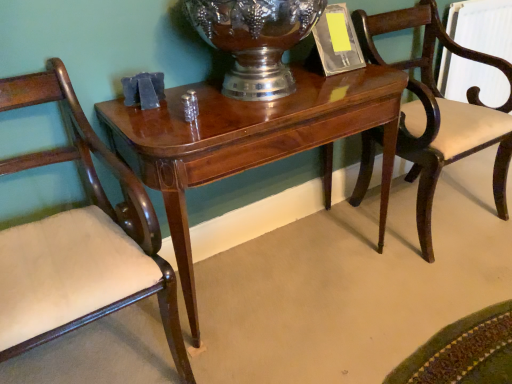
You are a GUI agent. You are given a task and a screenshot of the screen. Output one action in this format:
    pyautogui.click(x=<x>, y=<y>)
    Task: Click on the mahogany wood chair at left, arranged as the 2th chair when viewed from the right
    The image size is (512, 384).
    Given the screenshot: What is the action you would take?
    pyautogui.click(x=79, y=241)

How much space does mahogany wood chair at left, arranged as the first chair when viewed from the left, occupy vertically?

It is 34.05 inches.

I want to click on shiny wood table at center, so click(251, 141).

From a real-world perspective, is mahogany wood chair at left, arranged as the first chair when viewed from the left, positioned above or below shiny wood table at center?

In terms of real-world spatial position, mahogany wood chair at left, arranged as the first chair when viewed from the left, is above shiny wood table at center.

Is mahogany wood chair at left, arranged as the 2th chair when viewed from the right, far away from shiny wood table at center?

No.

Is mahogany wood chair at left, arranged as the 2th chair when viewed from the right, bigger than shiny wood table at center?

No.

Considering their positions, is shiny wood table at center located in front of or behind mahogany wood chair at left, arranged as the first chair when viewed from the left?

shiny wood table at center is positioned farther from the viewer than mahogany wood chair at left, arranged as the first chair when viewed from the left.

From a real-world perspective, starting from the shiny wood table at center, which chair is the 1st one vertically above it? Please provide its 2D coordinates.

[(79, 241)]

Is the surface of shiny wood table at center in direct contact with mahogany wood chair at left, arranged as the 2th chair when viewed from the right?

shiny wood table at center and mahogany wood chair at left, arranged as the 2th chair when viewed from the right, are not in contact.

From a real-world perspective, who is located lower, shiny wood table at center or mahogany wood chair at left, arranged as the 2th chair when viewed from the right?

In real-world perspective, shiny wood table at center is lower.

Is shiny silver vase at center facing towards mahogany wood chair at right, placed as the 2th chair when sorted from left to right?

No.

How different are the orientations of shiny silver vase at center and mahogany wood chair at right, the first chair when ordered from right to left, in degrees?

0.000304 degrees.

Which of these two, shiny silver vase at center or mahogany wood chair at right, the first chair when ordered from right to left, is wider?

Wider between the two is mahogany wood chair at right, the first chair when ordered from right to left.

The height and width of the screenshot is (384, 512). Identify the location of glass vase that is above the mahogany wood chair at right, placed as the 2th chair when sorted from left to right (from a real-world perspective). (255, 40).

From a real-world perspective, is mahogany wood chair at left, arranged as the 2th chair when viewed from the right, on mahogany wood chair at right, the first chair when ordered from right to left?

No.

How distant is mahogany wood chair at left, arranged as the 2th chair when viewed from the right, from mahogany wood chair at right, the first chair when ordered from right to left?

mahogany wood chair at left, arranged as the 2th chair when viewed from the right, and mahogany wood chair at right, the first chair when ordered from right to left, are 1.14 meters apart.

Which object is closer to the camera, mahogany wood chair at left, arranged as the first chair when viewed from the left, or mahogany wood chair at right, the first chair when ordered from right to left?

Positioned in front is mahogany wood chair at left, arranged as the first chair when viewed from the left.

Looking at the image, does mahogany wood chair at left, arranged as the 2th chair when viewed from the right, seem bigger or smaller compared to mahogany wood chair at right, the first chair when ordered from right to left?

In the image, mahogany wood chair at left, arranged as the 2th chair when viewed from the right, appears to be smaller than mahogany wood chair at right, the first chair when ordered from right to left.

Who is shorter, shiny silver vase at center or shiny wood table at center?

With less height is shiny silver vase at center.

Between shiny silver vase at center and shiny wood table at center, which one has smaller width?

With smaller width is shiny silver vase at center.

Based on their positions, is shiny silver vase at center located to the left or right of shiny wood table at center?

Based on their positions, shiny silver vase at center is located to the left of shiny wood table at center.

Could shiny wood table at center be considered to be inside shiny silver vase at center?

Actually, shiny wood table at center is outside shiny silver vase at center.

Is shiny wood table at center located outside shiny silver vase at center?

That's correct, shiny wood table at center is outside of shiny silver vase at center.

From the image's perspective, which one is positioned higher, shiny wood table at center or shiny silver vase at center?

shiny silver vase at center is shown above in the image.

From the picture: Is there a large distance between shiny wood table at center and shiny silver vase at center?

shiny wood table at center is near shiny silver vase at center, not far away.

Which is more to the left, shiny wood table at center or shiny silver vase at center?

Positioned to the left is shiny silver vase at center.

In the scene shown: Is shiny wood table at center closer to camera compared to mahogany wood chair at right, placed as the 2th chair when sorted from left to right?

Yes, shiny wood table at center is in front of mahogany wood chair at right, placed as the 2th chair when sorted from left to right.

Is shiny wood table at center not close to mahogany wood chair at right, the first chair when ordered from right to left?

No, shiny wood table at center is in close proximity to mahogany wood chair at right, the first chair when ordered from right to left.

Considering the positions of objects shiny wood table at center and mahogany wood chair at right, placed as the 2th chair when sorted from left to right, in the image provided, who is more to the right, shiny wood table at center or mahogany wood chair at right, placed as the 2th chair when sorted from left to right,?

mahogany wood chair at right, placed as the 2th chair when sorted from left to right, is more to the right.

You are a GUI agent. You are given a task and a screenshot of the screen. Output one action in this format:
    pyautogui.click(x=<x>, y=<y>)
    Task: Click on the table below the mahogany wood chair at left, arranged as the first chair when viewed from the left (from a real-world perspective)
    The image size is (512, 384).
    Given the screenshot: What is the action you would take?
    pyautogui.click(x=251, y=141)

Where is `chair in front of the shiny wood table at center`? The image size is (512, 384). chair in front of the shiny wood table at center is located at coordinates (79, 241).

Estimate the real-world distances between objects in this image. Which object is closer to shiny silver vase at center, shiny wood table at center or mahogany wood chair at right, placed as the 2th chair when sorted from left to right?

shiny wood table at center is positioned closer to the anchor shiny silver vase at center.

Looking at the image, which one is located further to shiny silver vase at center, mahogany wood chair at left, arranged as the first chair when viewed from the left, or shiny wood table at center?

mahogany wood chair at left, arranged as the first chair when viewed from the left, is positioned further to the anchor shiny silver vase at center.

Considering their positions, is mahogany wood chair at left, arranged as the first chair when viewed from the left, positioned closer to shiny silver vase at center than mahogany wood chair at right, the first chair when ordered from right to left?

Among the two, mahogany wood chair at left, arranged as the first chair when viewed from the left, is located nearer to shiny silver vase at center.

Estimate the real-world distances between objects in this image. Which object is closer to mahogany wood chair at right, placed as the 2th chair when sorted from left to right, shiny wood table at center or mahogany wood chair at left, arranged as the first chair when viewed from the left?

shiny wood table at center.

Considering their positions, is mahogany wood chair at left, arranged as the first chair when viewed from the left, positioned closer to mahogany wood chair at right, placed as the 2th chair when sorted from left to right, than shiny silver vase at center?

Based on the image, shiny silver vase at center appears to be nearer to mahogany wood chair at right, placed as the 2th chair when sorted from left to right.

Based on their spatial positions, is shiny wood table at center or mahogany wood chair at left, arranged as the first chair when viewed from the left, closer to shiny silver vase at center?

The object closer to shiny silver vase at center is shiny wood table at center.

Which object lies nearer to the anchor point mahogany wood chair at right, the first chair when ordered from right to left, mahogany wood chair at left, arranged as the 2th chair when viewed from the right, or shiny wood table at center?

shiny wood table at center.

Considering their positions, is shiny silver vase at center positioned further to mahogany wood chair at left, arranged as the 2th chair when viewed from the right, than shiny wood table at center?

shiny silver vase at center is positioned further to the anchor mahogany wood chair at left, arranged as the 2th chair when viewed from the right.

Locate an element on the screen. table situated between shiny silver vase at center and mahogany wood chair at right, placed as the 2th chair when sorted from left to right, from left to right is located at coordinates (251, 141).

Where is `table between shiny silver vase at center and mahogany wood chair at left, arranged as the 2th chair when viewed from the right, in the vertical direction`? table between shiny silver vase at center and mahogany wood chair at left, arranged as the 2th chair when viewed from the right, in the vertical direction is located at coordinates (251, 141).

Where is `table between mahogany wood chair at left, arranged as the 2th chair when viewed from the right, and mahogany wood chair at right, the first chair when ordered from right to left, in the horizontal direction`? Image resolution: width=512 pixels, height=384 pixels. table between mahogany wood chair at left, arranged as the 2th chair when viewed from the right, and mahogany wood chair at right, the first chair when ordered from right to left, in the horizontal direction is located at coordinates (251, 141).

Find the location of a particular element. The width and height of the screenshot is (512, 384). glass vase between mahogany wood chair at left, arranged as the first chair when viewed from the left, and mahogany wood chair at right, the first chair when ordered from right to left, from left to right is located at coordinates (255, 40).